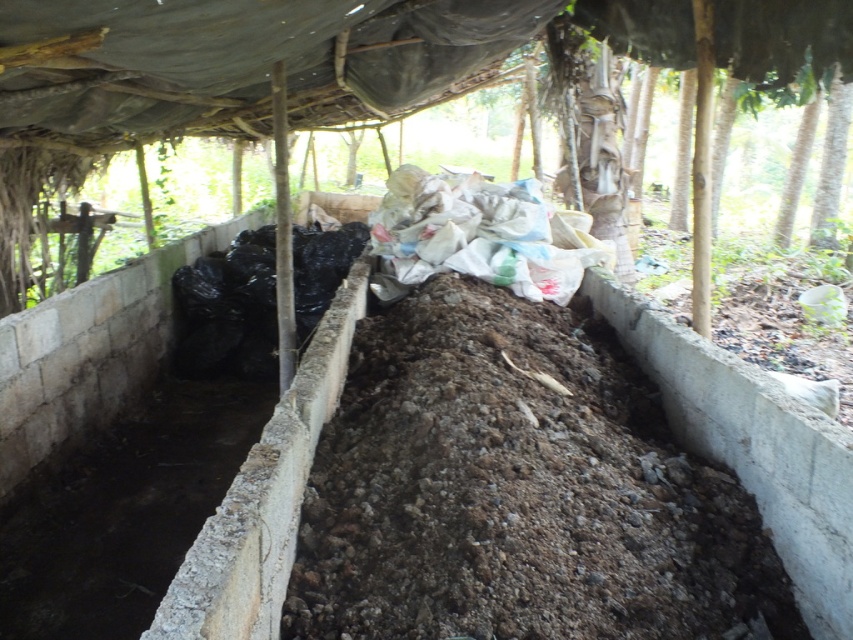
You are standing in the composting area and want to take a closer look at two specific points marked in the image. Which of the two points, point [558,268] or point [299,262], is nearer to you?

Point [558,268] is closer to the camera than point [299,262], so it is nearer to you.